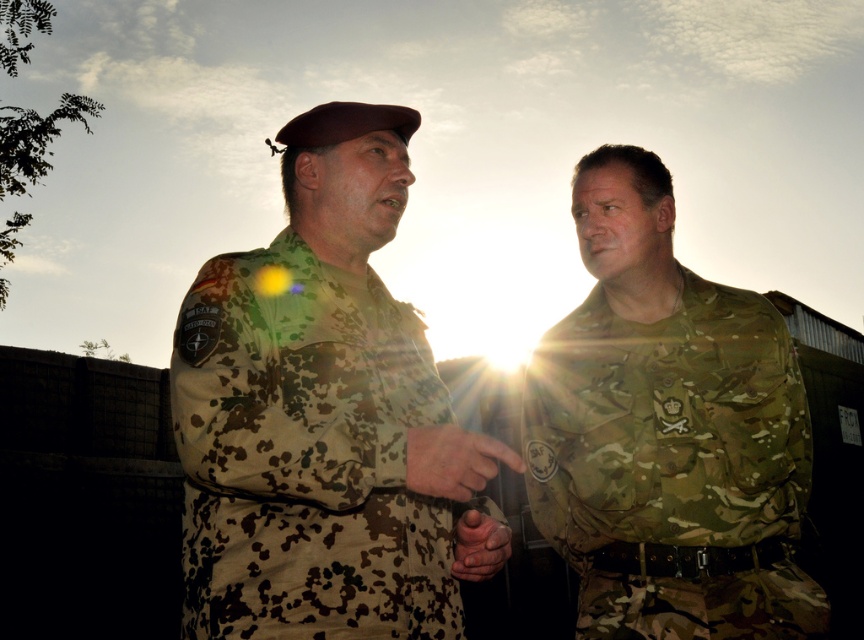
Consider the image. Who is shorter, camouflage uniform at center or camouflage fabric uniform at right?

With less height is camouflage uniform at center.

Is point (340, 163) in front of point (592, 200)?

Yes, it is.

Identify the location of camouflage uniform at center. (324, 417).